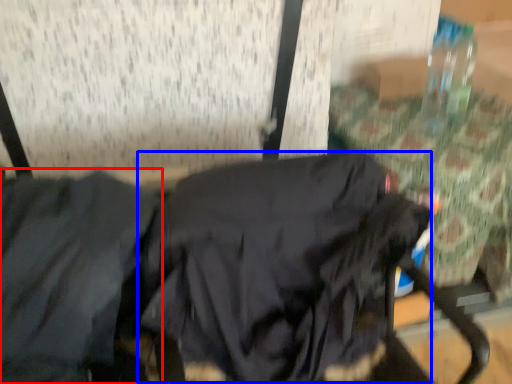
Question: Among these objects, which one is farthest to the camera, jacket (highlighted by a red box) or sweatshirt (highlighted by a blue box)?

Choices:
 (A) jacket
 (B) sweatshirt

Answer: (B)